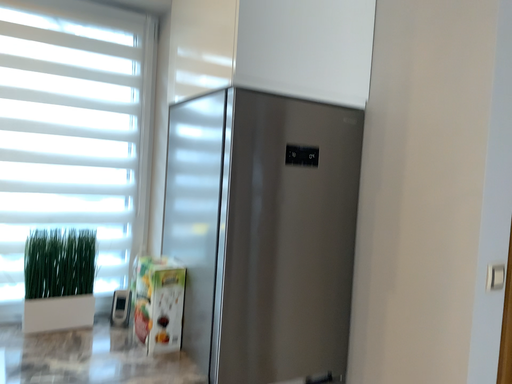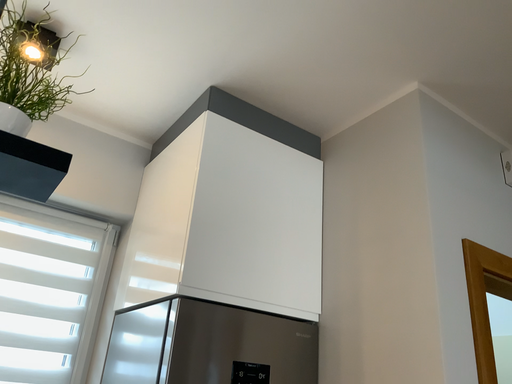
Question: How did the camera likely rotate when shooting the video?

Choices:
 (A) rotated downward
 (B) rotated upward

Answer: (B)